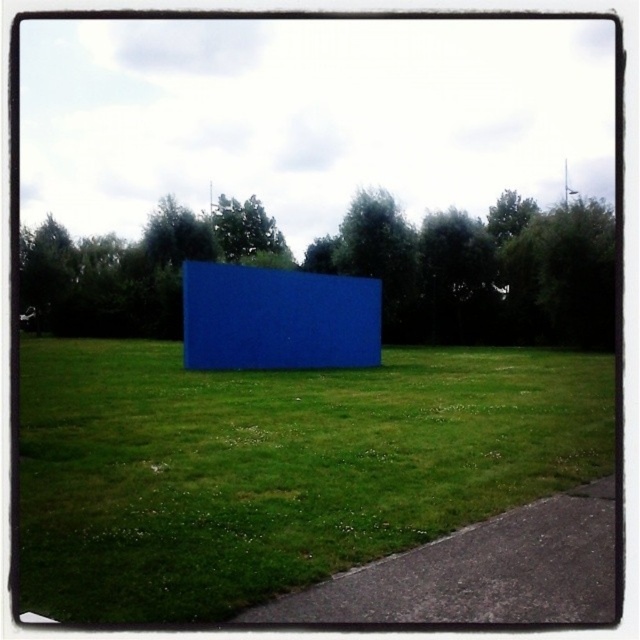
You are an architect designing a garden layout. You need to place a new sculpture exactly halfway between the blue matte cube at center and the blue matte rectangular object at center. Which direction should you move from the cube to reach the midpoint?

Since the blue matte cube at center is not as tall as the blue matte rectangular object at center, the midpoint between them would require knowing their positions. However, the description only provides height information, not horizontal positioning. Without knowing their exact horizontal positions, the direction cannot be determined based on the given information.

You are standing at the bottom right corner of the grassy field. You want to walk directly towards the blue matte cube at center. Which direction should you head? Please answer with either North, South, East, or West.

The blue matte cube at center is located at point (276, 467). Since you are at the bottom right corner, which is typically the lower right quadrant, moving towards the center would require heading North and slightly East. However, since the question asks for a cardinal direction, the closest is North.